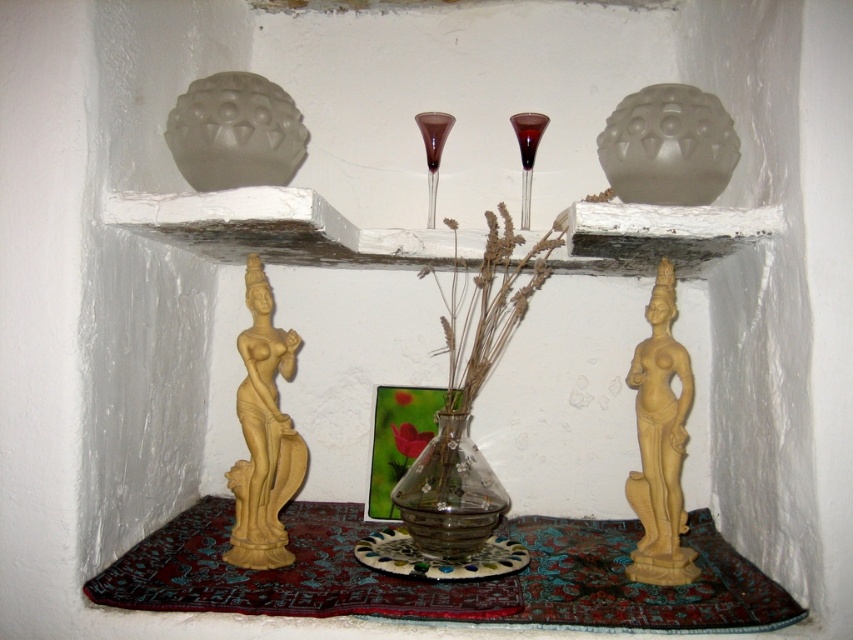
You are an interior designer arranging items in the alcove. You need to place a new small decorative item on the ornate table with the red and blue rug. Which statue, the matte yellow statue at lower left or the matte yellow statue at lower right, would allow more space for the new item?

The matte yellow statue at lower right is larger, so placing the new item next to it would leave less space. The matte yellow statue at lower left is smaller, allowing more space for the new item.

Looking at this image, you are arranging flowers in the transparent glass vase at center and need to place a decorative statue to its left. Is the matte yellow statue at lower left positioned correctly?

Yes, the matte yellow statue at lower left is already positioned to the left of the transparent glass vase at center, so it is correctly placed.